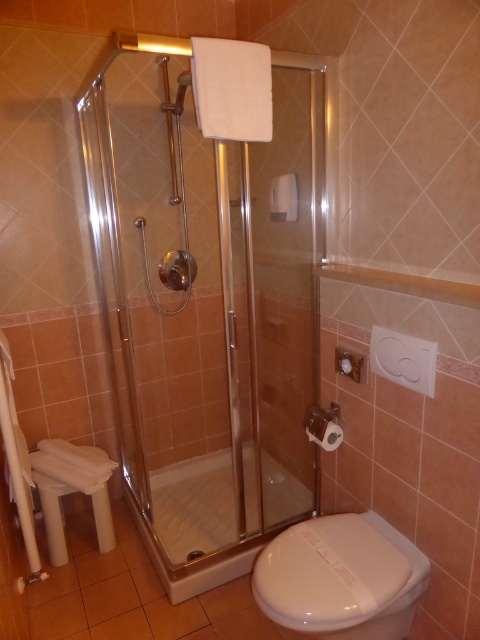
Question: Which is nearer to the white plastic stool at lower left?

Choices:
 (A) clear glass shower door at center
 (B) transparent glass shower at lower center
 (C) white glossy toilet at lower right

Answer: (B)

Question: Estimate the real-world distances between objects in this image. Which object is farther from the transparent glass shower at lower center?

Choices:
 (A) white plastic stool at lower left
 (B) white glossy toilet at lower right
 (C) clear glass shower door at center

Answer: (B)

Question: Can you confirm if transparent glass shower at lower center is positioned to the left of white plastic stool at lower left?

Choices:
 (A) yes
 (B) no

Answer: (B)

Question: Which point is closer to the camera taking this photo?

Choices:
 (A) (265, 493)
 (B) (288, 486)
 (C) (319, 588)

Answer: (C)

Question: Can you confirm if clear glass shower door at center is positioned above white glossy toilet at lower right?

Choices:
 (A) yes
 (B) no

Answer: (A)

Question: Can you confirm if clear glass shower door at center is positioned below transparent glass shower at lower center?

Choices:
 (A) yes
 (B) no

Answer: (B)